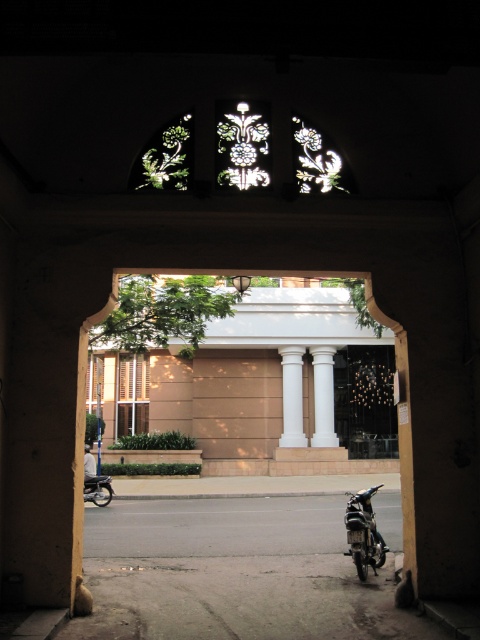
Who is higher up, white smooth column at center or white marble pillar at center?

Positioned higher is white smooth column at center.

Is point (288, 426) positioned before point (334, 429)?

Yes.

Find the location of a particular element. white smooth column at center is located at coordinates (291, 396).

Does shiny black motorcycle at lower right appear on the left side of white smooth column at center?

In fact, shiny black motorcycle at lower right is to the right of white smooth column at center.

Is shiny black motorcycle at lower right positioned at the back of white smooth column at center?

That is False.

Where is `shiny black motorcycle at lower right`? shiny black motorcycle at lower right is located at coordinates (363, 532).

You are a GUI agent. You are given a task and a screenshot of the screen. Output one action in this format:
    pyautogui.click(x=<x>, y=<y>)
    Task: Click on the shiny black motorcycle at lower right
    The height and width of the screenshot is (640, 480).
    Given the screenshot: What is the action you would take?
    pyautogui.click(x=363, y=532)

Is shiny black motorcycle at lower right positioned at the back of white marble pillar at center?

No, shiny black motorcycle at lower right is closer to the viewer.

Between point (384, 540) and point (333, 376), which one is positioned in front?

Point (384, 540)

You are a GUI agent. You are given a task and a screenshot of the screen. Output one action in this format:
    pyautogui.click(x=<x>, y=<y>)
    Task: Click on the shiny black motorcycle at lower right
    
    Given the screenshot: What is the action you would take?
    pyautogui.click(x=363, y=532)